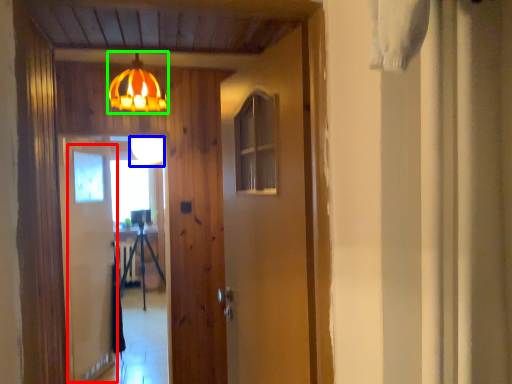
Question: Which object is the farthest from screen door (highlighted by a red box)? Choose among these: lamp (highlighted by a blue box) or lamp (highlighted by a green box).

Choices:
 (A) lamp
 (B) lamp

Answer: (B)